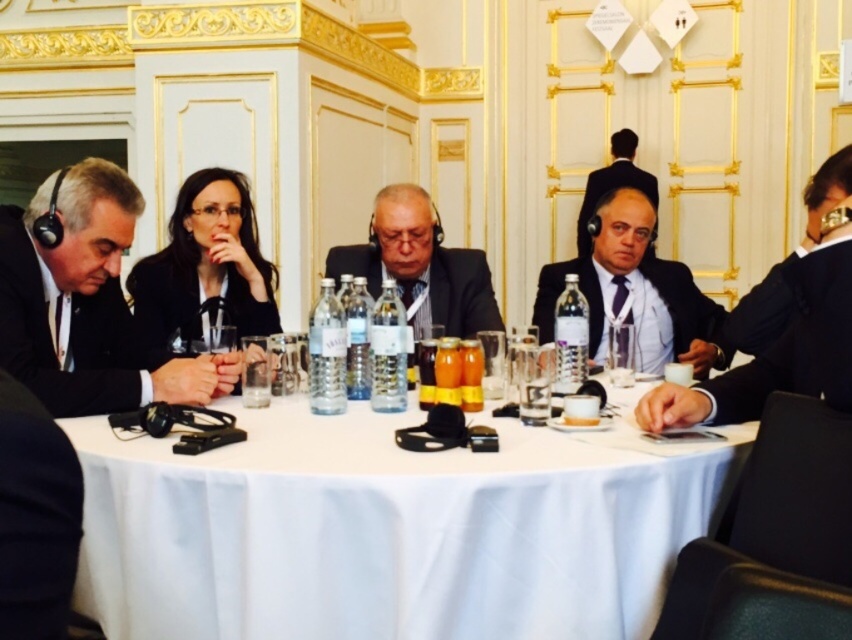
Question: Does black matte suit at left appear under matte black suit at upper center?

Choices:
 (A) no
 (B) yes

Answer: (B)

Question: Which of the following is the farthest from the observer?

Choices:
 (A) matte black suit at upper center
 (B) black matte suit at left

Answer: (A)

Question: Can you confirm if black fabric suit at right is wider than matte black suit at upper center?

Choices:
 (A) yes
 (B) no

Answer: (B)

Question: Which is farther from the matte black suit at center?

Choices:
 (A) black matte suit at left
 (B) dark gray suit at center
 (C) white cloth at center
 (D) matte black suit at upper center

Answer: (D)

Question: Is white cloth at center below black fabric suit at right?

Choices:
 (A) no
 (B) yes

Answer: (B)

Question: Which of the following is the farthest from the observer?

Choices:
 (A) black matte suit at left
 (B) white cloth at center
 (C) matte black suit at center

Answer: (C)